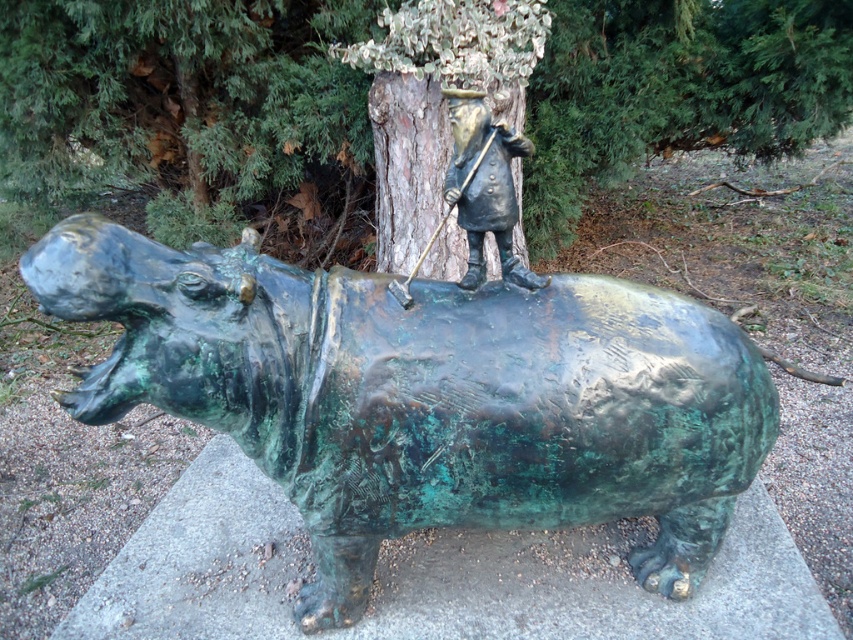
Does green patina hippo at center have a smaller size compared to green textured tree trunk at center?

Correct, green patina hippo at center occupies less space than green textured tree trunk at center.

Does green patina hippo at center have a larger size compared to green textured tree trunk at center?

No.

This screenshot has width=853, height=640. What do you see at coordinates (425, 396) in the screenshot?
I see `green patina hippo at center` at bounding box center [425, 396].

Find the location of `green patina hippo at center`. green patina hippo at center is located at coordinates [425, 396].

Which is below, green patina hippo at center or bronze statue at center?

green patina hippo at center is below.

Can you confirm if green patina hippo at center is positioned below bronze statue at center?

Indeed, green patina hippo at center is positioned under bronze statue at center.

Between point (668, 492) and point (488, 177), which one is positioned behind?

The point (668, 492) is more distant.

Image resolution: width=853 pixels, height=640 pixels. I want to click on green patina hippo at center, so click(425, 396).

Is green textured tree trunk at center taller than bronze statue at center?

Correct, green textured tree trunk at center is much taller as bronze statue at center.

Does point (56, 108) come behind point (456, 93)?

Yes, it is behind point (456, 93).

Is point (589, 80) farther from viewer compared to point (479, 202)?

Yes.

This screenshot has height=640, width=853. I want to click on green textured tree trunk at center, so click(173, 104).